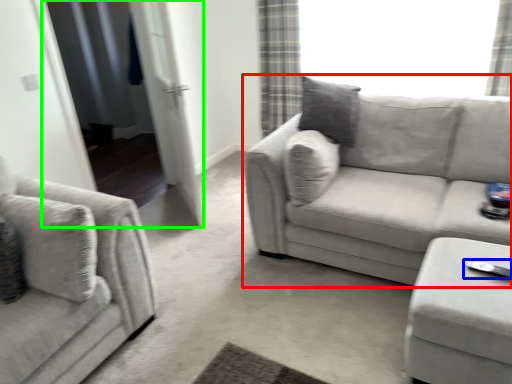
Question: Considering the real-world distances, which object is closest to studio couch (highlighted by a red box)? Wii controller (highlighted by a blue box) or screen door (highlighted by a green box).

Choices:
 (A) Wii controller
 (B) screen door

Answer: (A)